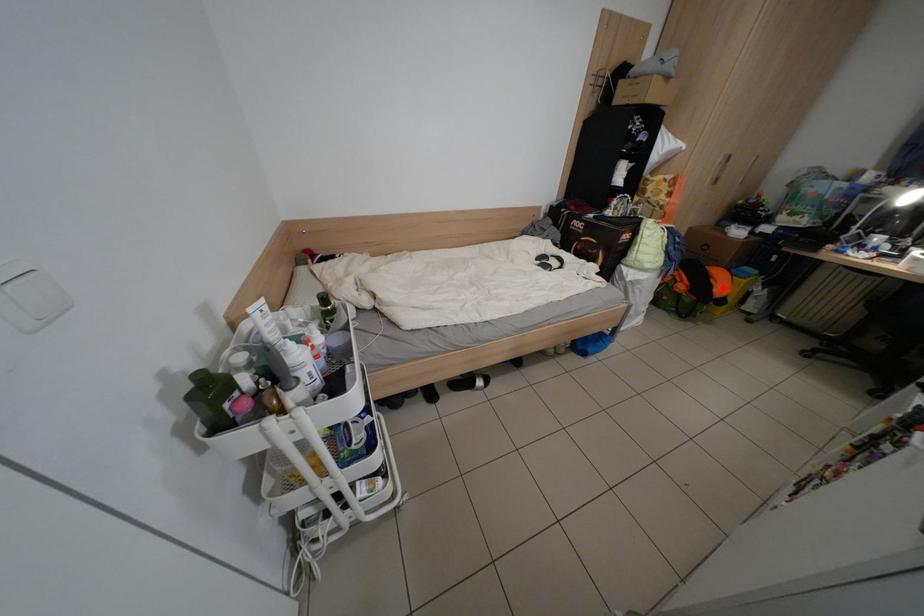
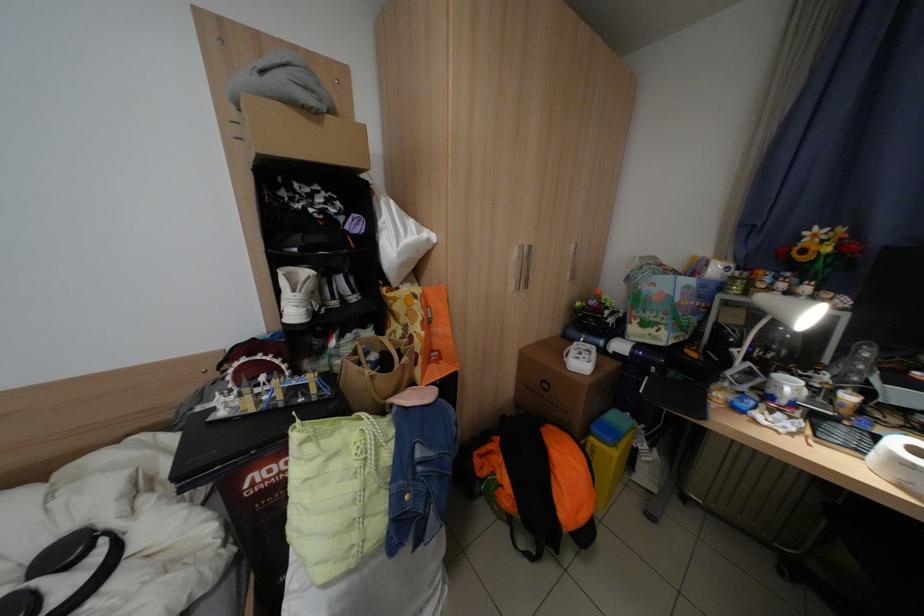
Question: A red point is marked in image1. In image2, is the corresponding 3D point closer to the camera or farther? Reply with the corresponding letter.

Choices:
 (A) The corresponding 3D point is closer.
 (B) The corresponding 3D point is farther.

Answer: (B)